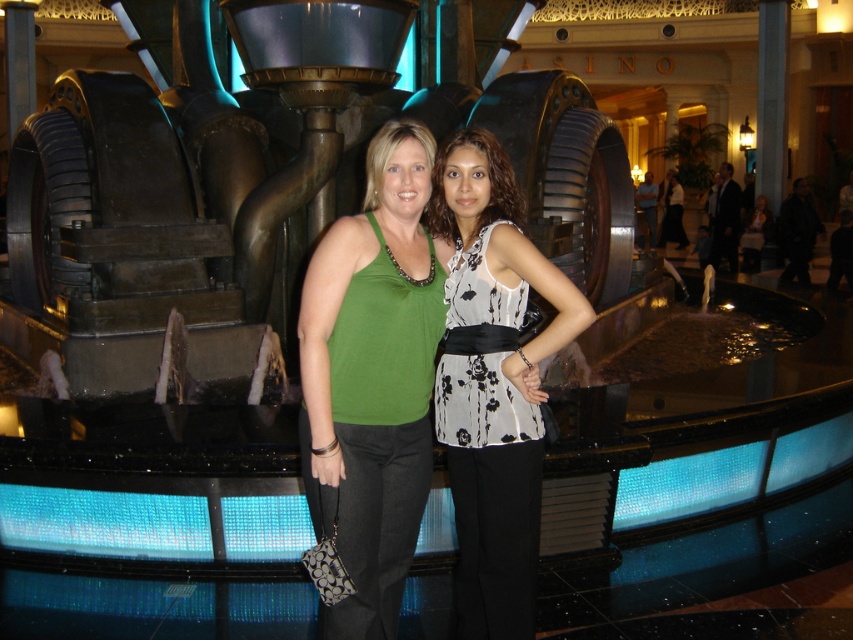
You are a fashion designer observing two women in a casino setting near an ornate fountain. The women are wearing the green fabric tank top at center and the floral print blouse at center. Which of these two garments appears shorter in length?

The green fabric tank top at center is not as tall as the floral print blouse at center, so the green fabric tank top at center appears shorter in length.

You are a photographer trying to capture a photo of both the green fabric tank top at center and the floral print blouse at center. Which one should you focus on first if you want to include both in the frame without moving the camera?

You should focus on the green fabric tank top at center first because it is positioned on the left side of the floral print blouse at center, so capturing it first ensures both are in the frame.